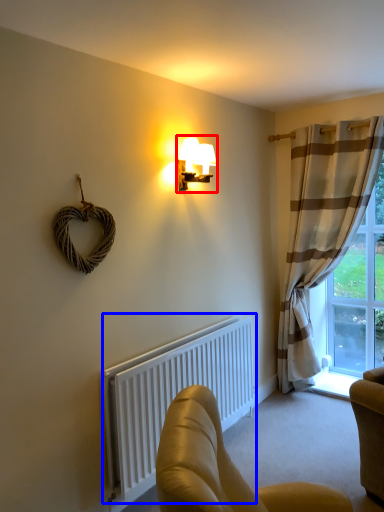
Question: Which of the following is the farthest to the observer, lamp (highlighted by a red box) or radiator (highlighted by a blue box)?

Choices:
 (A) lamp
 (B) radiator

Answer: (A)